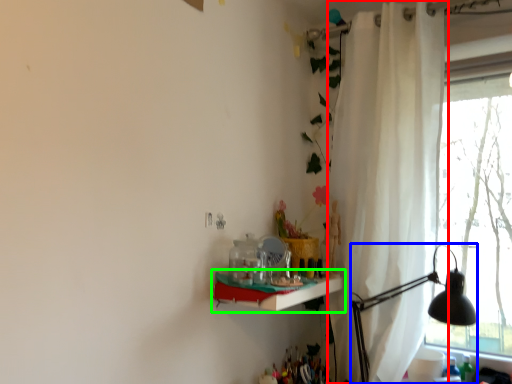
Question: Estimate the real-world distances between objects in this image. Which object is farther from curtain (highlighted by a red box), table lamp (highlighted by a blue box) or shelf (highlighted by a green box)?

Choices:
 (A) table lamp
 (B) shelf

Answer: (B)